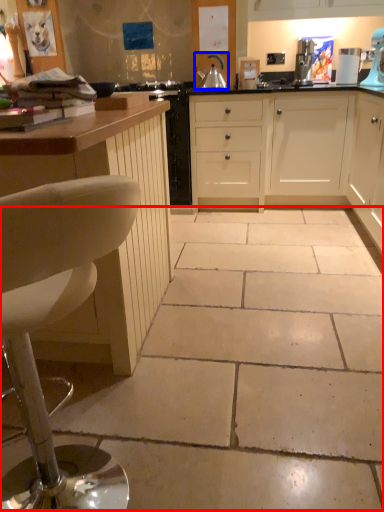
Question: Which of the following is the farthest to the observer, concrete (highlighted by a red box) or kitchen appliance (highlighted by a blue box)?

Choices:
 (A) concrete
 (B) kitchen appliance

Answer: (B)